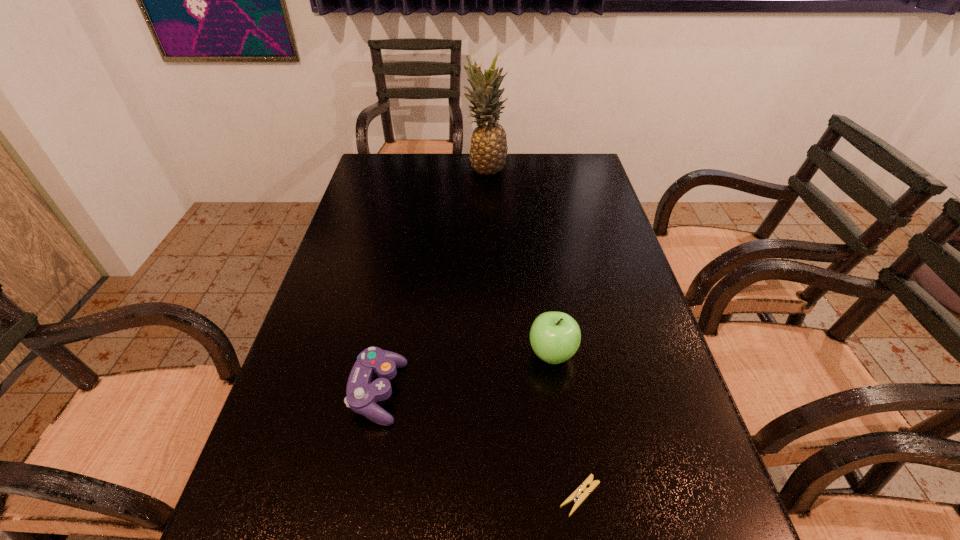
Where is `vacant space in between the apple and the farthest object`? The width and height of the screenshot is (960, 540). vacant space in between the apple and the farthest object is located at coordinates (519, 261).

Locate an element on the screen. The image size is (960, 540). free space between the second object from left to right and the second tallest object is located at coordinates (519, 261).

The height and width of the screenshot is (540, 960). In order to click on object that is the third nearest to the second tallest object in this screenshot , I will do `click(488, 151)`.

This screenshot has width=960, height=540. I want to click on object that stands as the second closest to the third object from right to left, so click(363, 392).

The height and width of the screenshot is (540, 960). Find the location of `free space that satisfies the following two spatial constraints: 1. on the front side of the clothespin; 2. on the left side of the third tallest object`. free space that satisfies the following two spatial constraints: 1. on the front side of the clothespin; 2. on the left side of the third tallest object is located at coordinates (358, 496).

This screenshot has height=540, width=960. What are the coordinates of `blank space that satisfies the following two spatial constraints: 1. on the back side of the leftmost object; 2. on the left side of the second tallest object` in the screenshot? It's located at click(386, 354).

Locate an element on the screen. This screenshot has height=540, width=960. vacant position in the image that satisfies the following two spatial constraints: 1. on the front side of the nearest object; 2. on the right side of the apple is located at coordinates (573, 496).